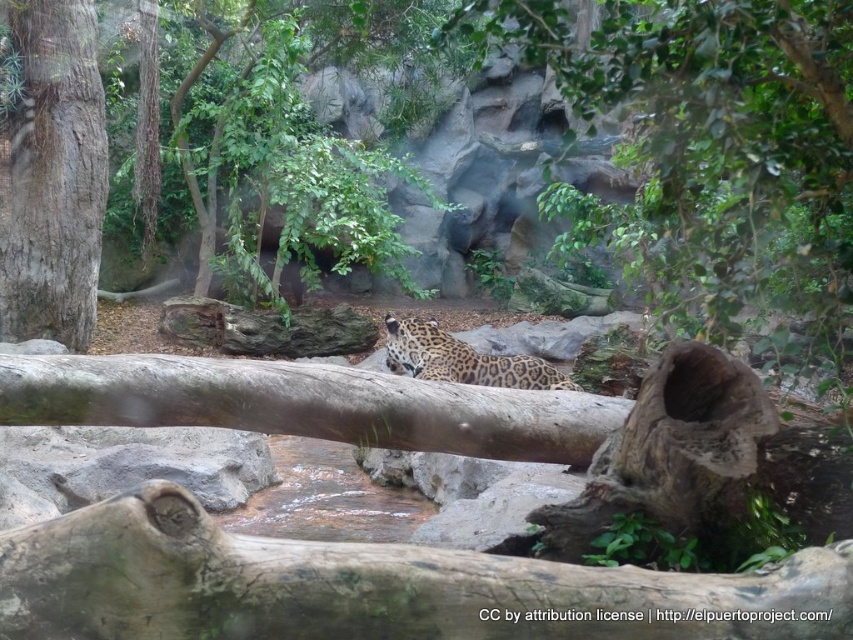
Can you confirm if green leafy tree at center is taller than rough bark tree trunk at left?

In fact, green leafy tree at center may be shorter than rough bark tree trunk at left.

Who is more distant from viewer, (x=730, y=48) or (x=54, y=8)?

The point (x=54, y=8) is more distant.

Is point (639, 24) more distant than point (107, 160)?

No, (639, 24) is closer to viewer.

Identify the location of green leafy tree at center. This screenshot has width=853, height=640. (706, 140).

Looking at this image, between brown rough log at center and spotted fur leopard at center, which one has more height?

Standing taller between the two is spotted fur leopard at center.

Which is above, brown rough log at center or spotted fur leopard at center?

Positioned higher is spotted fur leopard at center.

Locate an element on the screen. brown rough log at center is located at coordinates (306, 404).

Is point (172, 620) farther from camera compared to point (392, 362)?

No.

Can you confirm if smooth brown log at center is wider than spotted fur leopard at center?

Indeed, smooth brown log at center has a greater width compared to spotted fur leopard at center.

Is point (126, 492) positioned behind point (421, 356)?

No, it is not.

Where is `smooth brown log at center`? smooth brown log at center is located at coordinates (373, 586).